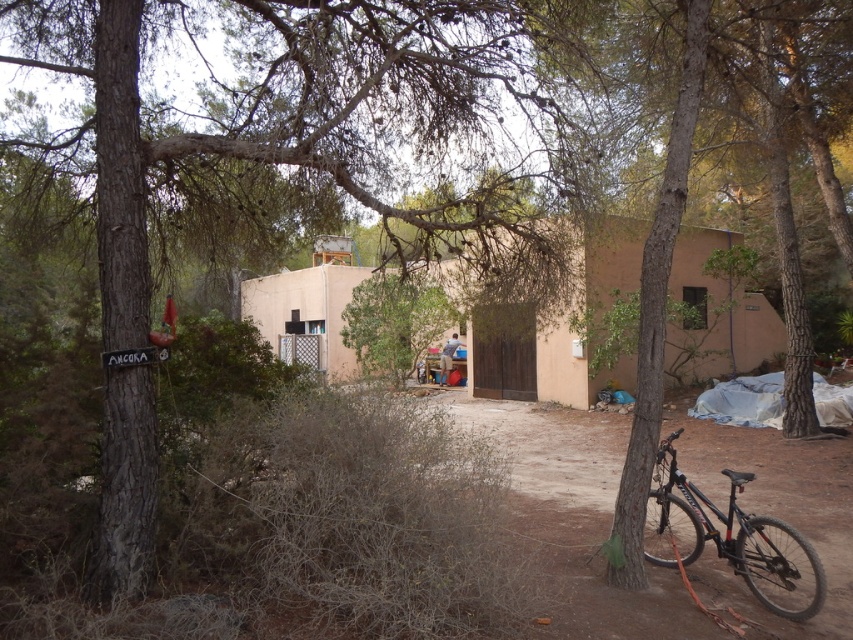
You are a delivery person trying to park your black matte mountain bike at lower right near the beige stucco hut at center. The delivery company requires that the bike must be parked at least 2 meters away from any structure. Can you park it closer than 2 meters?

The beige stucco hut at center is much taller than the black matte mountain bike at lower right, but the height difference does not affect the parking distance requirement. Since the question is about distance from the structure, the height of the hut is irrelevant. Therefore, you must park the black matte mountain bike at lower right at least 2 meters away from the beige stucco hut at center.

You are standing in front of the beige stucco hut at center and want to look down to see the black matte mountain bike at lower right. Is the bike located below the hut?

The beige stucco hut at center is above the black matte mountain bike at lower right, so yes, the bike is located below the hut.